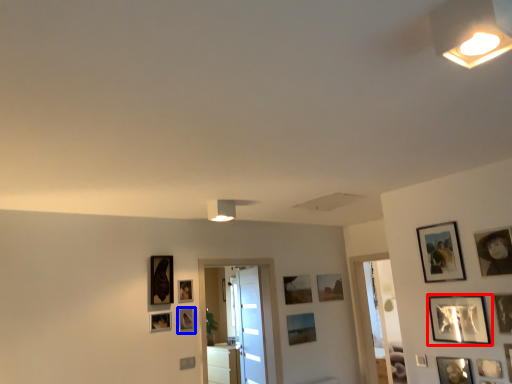
Question: Which object is closer to the camera taking this photo, picture frame (highlighted by a red box) or picture frame (highlighted by a blue box)?

Choices:
 (A) picture frame
 (B) picture frame

Answer: (A)